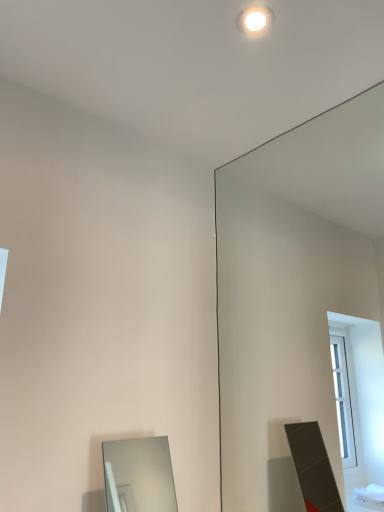
Question: Relative to smooth silver mirror at lower left, acting as the 2th mirror starting from the right, is clear glass mirror at upper right, which ranks as the first mirror in right-to-left order, in front or behind?

Choices:
 (A) front
 (B) behind

Answer: (A)

Question: Choose the correct answer: Is clear glass mirror at upper right, the 2th mirror from the left, inside smooth silver mirror at lower left, arranged as the 1th mirror when viewed from the left, or outside it?

Choices:
 (A) inside
 (B) outside

Answer: (B)

Question: Estimate the real-world distances between objects in this image. Which object is farther from the white glossy light fixture at upper center?

Choices:
 (A) smooth silver mirror at lower left, arranged as the 1th mirror when viewed from the left
 (B) clear glass mirror at upper right, which ranks as the first mirror in right-to-left order

Answer: (A)

Question: Considering the real-world distances, which object is closest to the clear glass mirror at upper right, which ranks as the first mirror in right-to-left order?

Choices:
 (A) smooth silver mirror at lower left, arranged as the 1th mirror when viewed from the left
 (B) white glossy light fixture at upper center

Answer: (B)